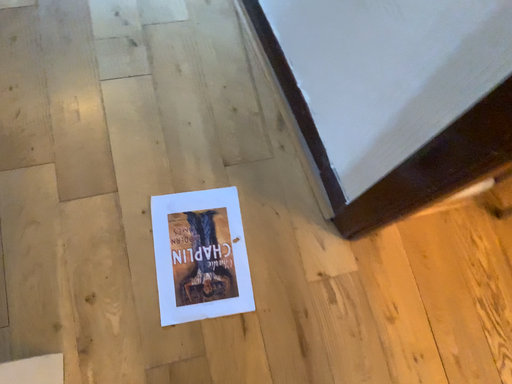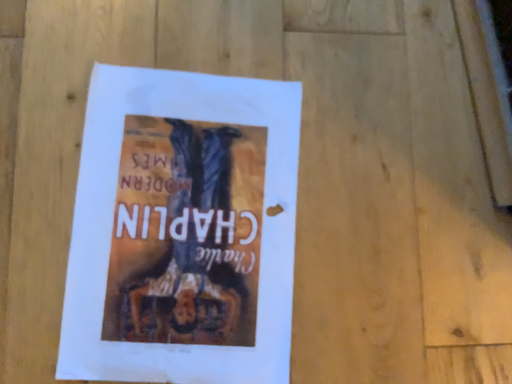
Question: Which way did the camera rotate in the video?

Choices:
 (A) rotated upward
 (B) rotated downward

Answer: (B)